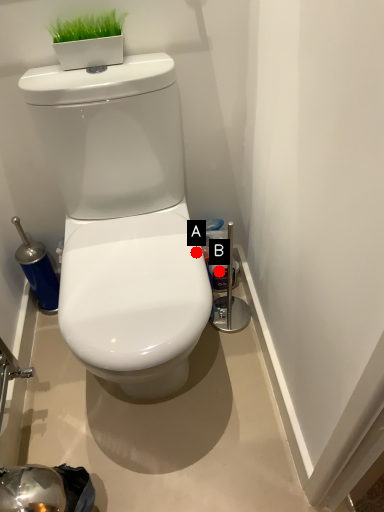
Question: Two points are circled on the image, labeled by A and B beside each circle. Which point appears closest to the camera in this image?

Choices:
 (A) A is closer
 (B) B is closer

Answer: (A)